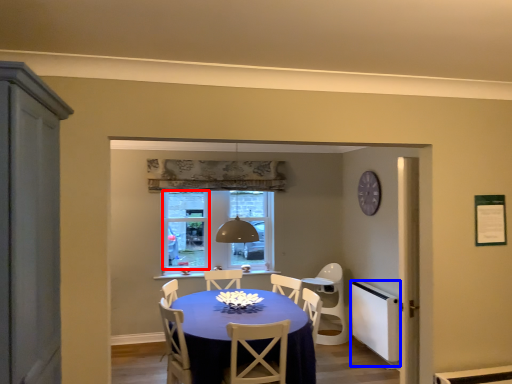
Question: Which object appears farthest to the camera in this image, window screen (highlighted by a red box) or appliance (highlighted by a blue box)?

Choices:
 (A) window screen
 (B) appliance

Answer: (A)